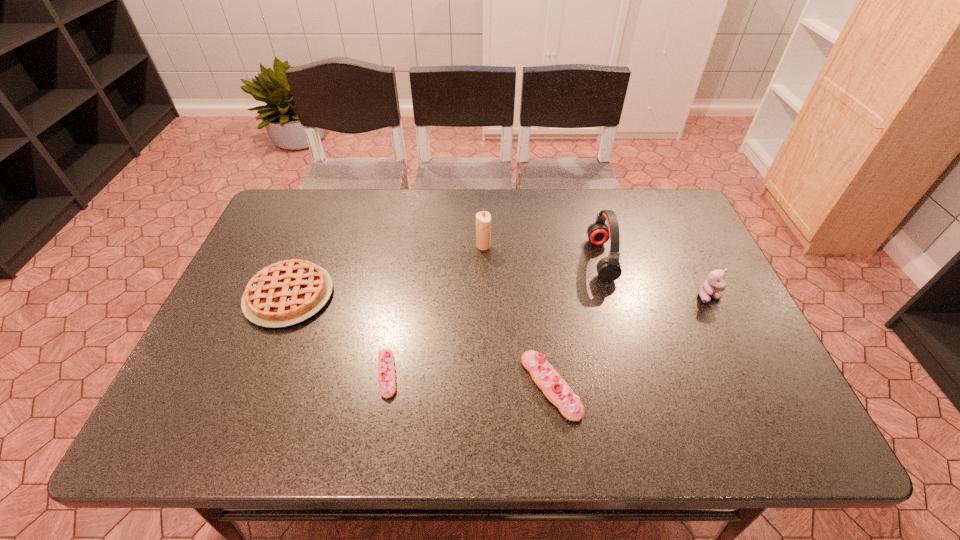
Please point out where to position a new eclair on the right to maintain spacing. Please provide its 2D coordinates. Your answer should be formatted as a tuple, i.e. [(x, y)], where the tuple contains the x and y coordinates of a point satisfying the conditions above.

[(722, 399)]